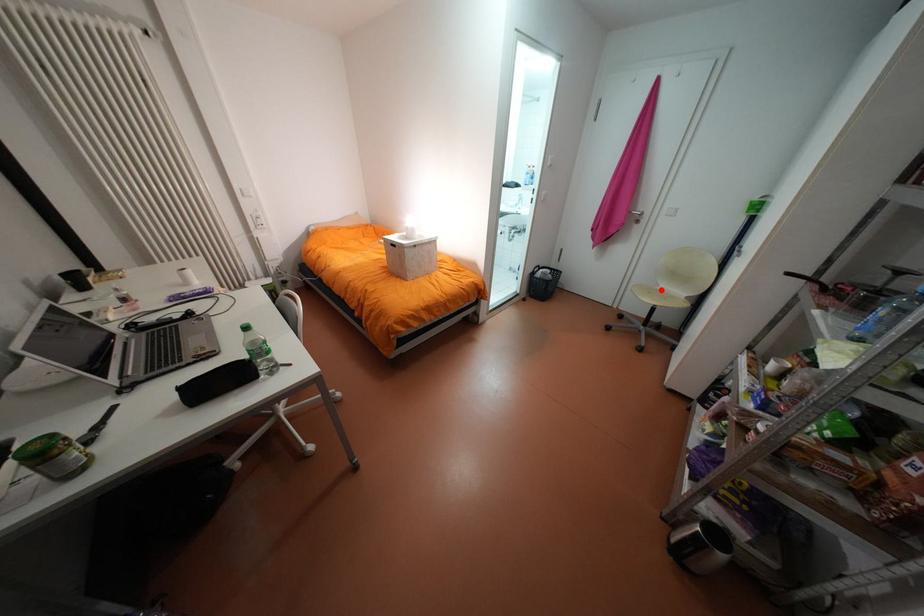
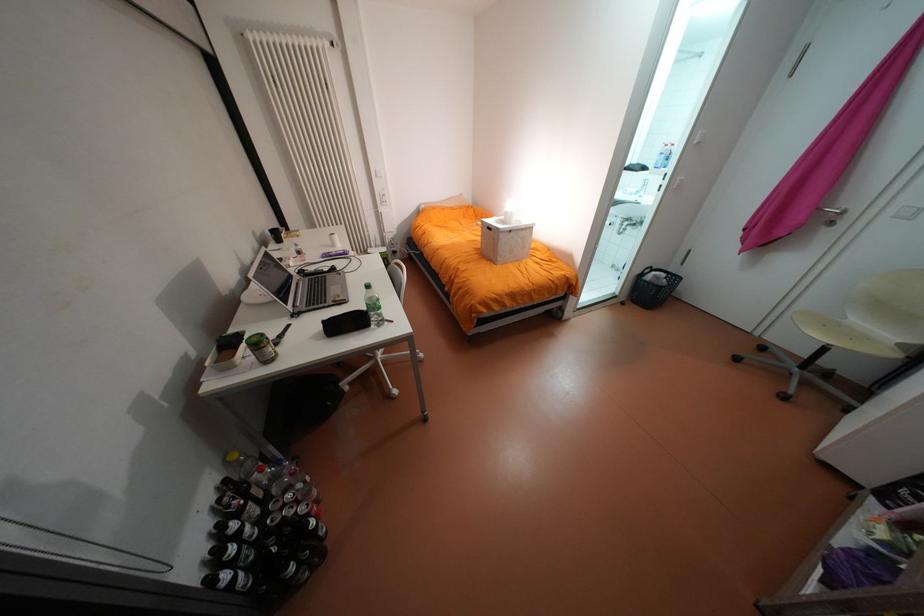
Find the pixel in the second image that matches the highlighted location in the first image.

(840, 323)